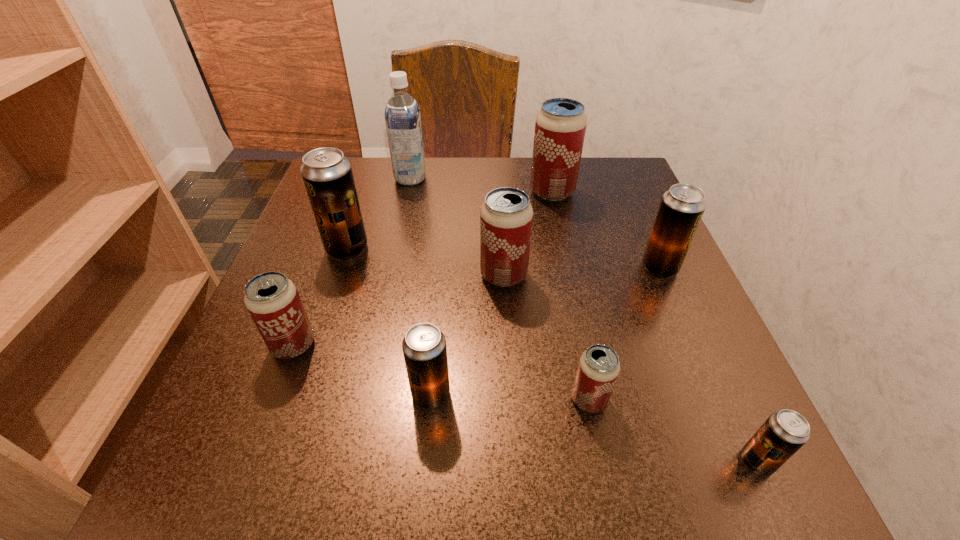
Find the location of a particular element. The image size is (960, 540). the fifth farthest beer can is located at coordinates (272, 300).

Identify the location of the second smallest red beer can. (272, 300).

This screenshot has width=960, height=540. In order to click on the nearest red beer can in this screenshot , I will do `click(598, 369)`.

Where is `the nearest black beer can`? The width and height of the screenshot is (960, 540). the nearest black beer can is located at coordinates (785, 431).

You are a GUI agent. You are given a task and a screenshot of the screen. Output one action in this format:
    pyautogui.click(x=<x>, y=<y>)
    Task: Click on the nearest object
    Image resolution: width=960 pixels, height=540 pixels.
    Given the screenshot: What is the action you would take?
    pyautogui.click(x=785, y=431)

Where is `vacant region located 0.360m on the label of the tallest object`? The image size is (960, 540). vacant region located 0.360m on the label of the tallest object is located at coordinates (577, 178).

The image size is (960, 540). What are the coordinates of `free space located 0.070m on the right of the biggest red beer can` in the screenshot? It's located at (606, 192).

You are a GUI agent. You are given a task and a screenshot of the screen. Output one action in this format:
    pyautogui.click(x=<x>, y=<y>)
    Task: Click on the free point located on the front of the biggest black beer can
    This screenshot has height=540, width=960.
    Given the screenshot: What is the action you would take?
    pyautogui.click(x=310, y=359)

You are a GUI agent. You are given a task and a screenshot of the screen. Output one action in this format:
    pyautogui.click(x=<x>, y=<y>)
    Task: Click on the vacant space located 0.350m on the front of the third smallest black beer can
    The height and width of the screenshot is (540, 960).
    Given the screenshot: What is the action you would take?
    pyautogui.click(x=750, y=478)

At what (x,y) coordinates should I click in order to perform the action: click on vacant space located 0.090m on the back of the second red beer can from left to right. Please return your answer as a coordinate pair (x, y). Looking at the image, I should click on 501,230.